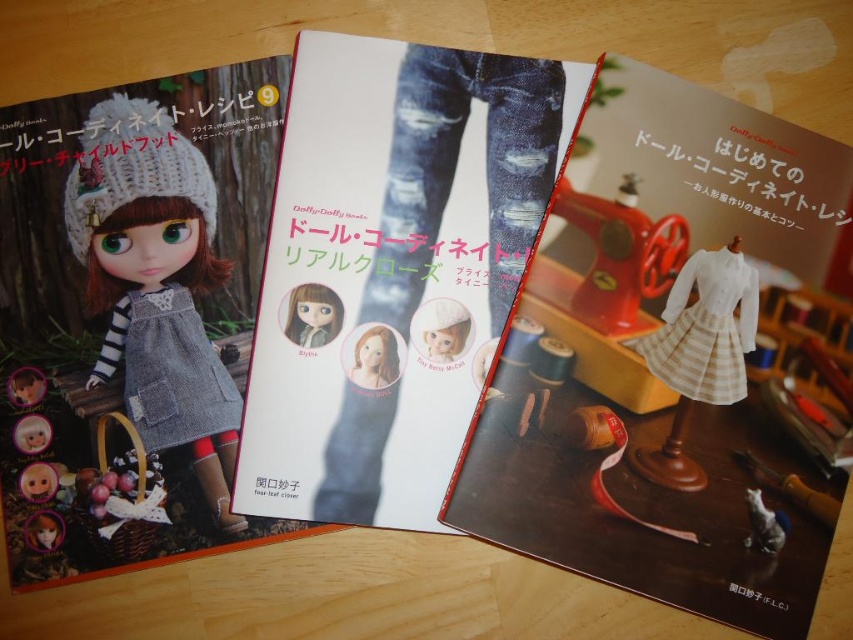
Question: Is white cotton dress at center to the right of matte gray doll at center from the viewer's perspective?

Choices:
 (A) yes
 (B) no

Answer: (A)

Question: Can you confirm if denim jeans at center is bigger than matte gray doll at center?

Choices:
 (A) yes
 (B) no

Answer: (A)

Question: Based on their relative distances, which object is nearer to the striped fabric dress at center?

Choices:
 (A) denim jeans at center
 (B) white cotton dress at center
 (C) matte gray doll at center
 (D) white matte doll at center

Answer: (B)

Question: Can you confirm if denim jeans at center is positioned above matte gray doll at center?

Choices:
 (A) yes
 (B) no

Answer: (A)

Question: Which point is closer to the camera taking this photo?

Choices:
 (A) (654, 458)
 (B) (184, 401)
 (C) (534, 369)

Answer: (A)

Question: Which of the following is the closest to the observer?

Choices:
 (A) white matte doll at center
 (B) striped fabric dress at center
 (C) denim dress at left
 (D) white cotton dress at center

Answer: (B)